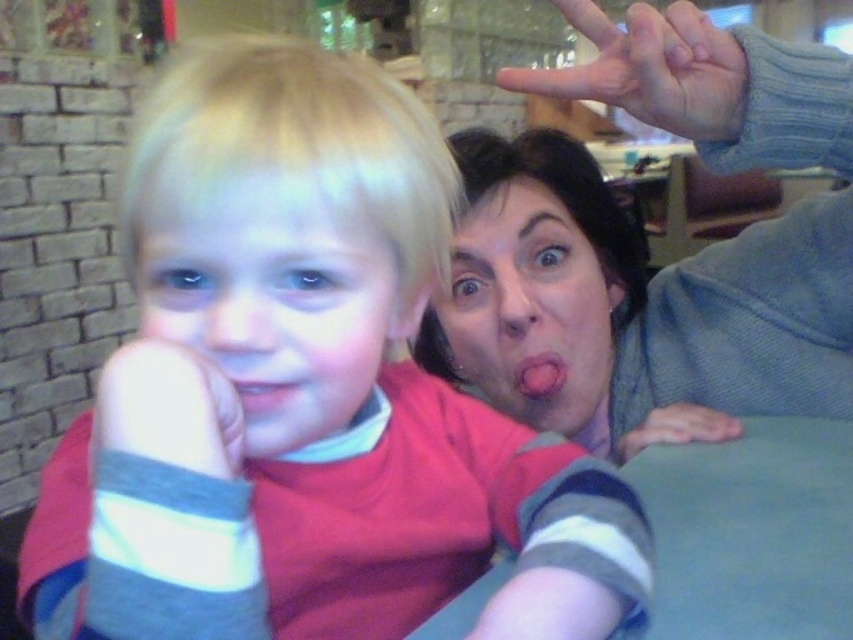
Question: Does smooth gray hand at upper right have a larger size compared to smooth gray hand at lower right?

Choices:
 (A) yes
 (B) no

Answer: (A)

Question: Is the position of matte blue sweater at upper right less distant than that of pink matte tongue at center?

Choices:
 (A) no
 (B) yes

Answer: (B)

Question: Which point is closer to the camera?

Choices:
 (A) blonde hair at center
 (B) pink glossy lips at center
 (C) striped sock at lower left
 (D) striped sock at center

Answer: (D)

Question: Where is matte blue sweater at upper right located in relation to smooth gray hand at lower right in the image?

Choices:
 (A) left
 (B) right

Answer: (A)

Question: Which of the following is the farthest from the observer?

Choices:
 (A) smooth gray hand at lower right
 (B) matte pink face at center
 (C) pink matte tongue at center
 (D) smooth gray hand at upper right

Answer: (C)

Question: Among these points, which one is farthest from the camera?

Choices:
 (A) (236, 404)
 (B) (303, 396)

Answer: (B)